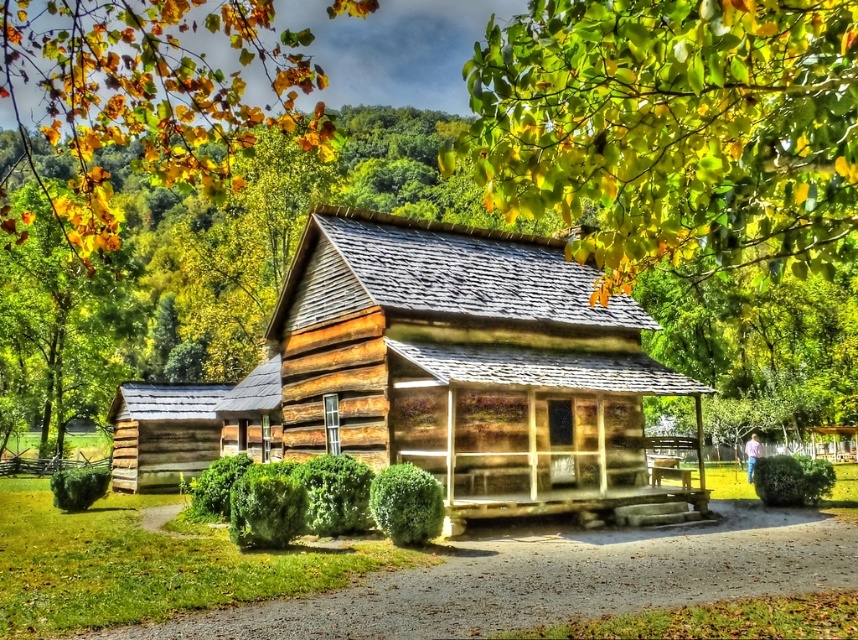
Is yellow-green leaves at upper center above wooden log cabin at center?

Indeed, yellow-green leaves at upper center is positioned over wooden log cabin at center.

Can you confirm if yellow-green leaves at upper center is positioned to the left of wooden log cabin at center?

In fact, yellow-green leaves at upper center is to the right of wooden log cabin at center.

Which is in front, point (801, 244) or point (427, 433)?

Point (801, 244)

Where is `yellow-green leaves at upper center`? Image resolution: width=858 pixels, height=640 pixels. yellow-green leaves at upper center is located at coordinates (672, 129).